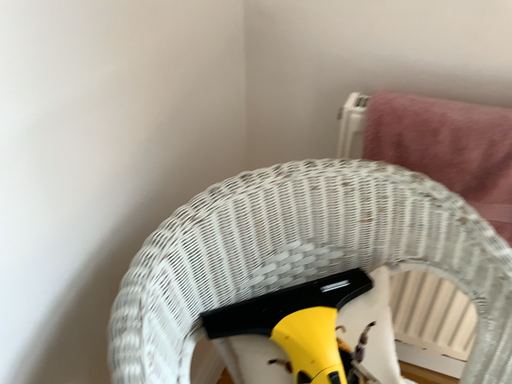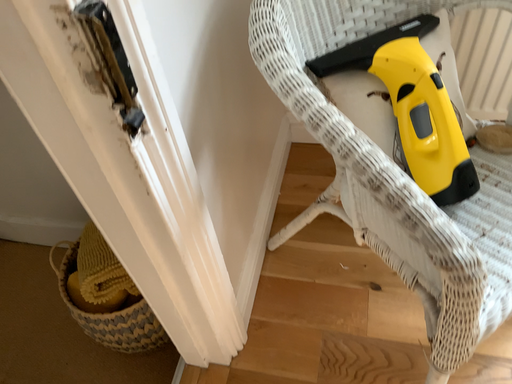
Question: Which way did the camera rotate in the video?

Choices:
 (A) rotated downward
 (B) rotated upward

Answer: (A)